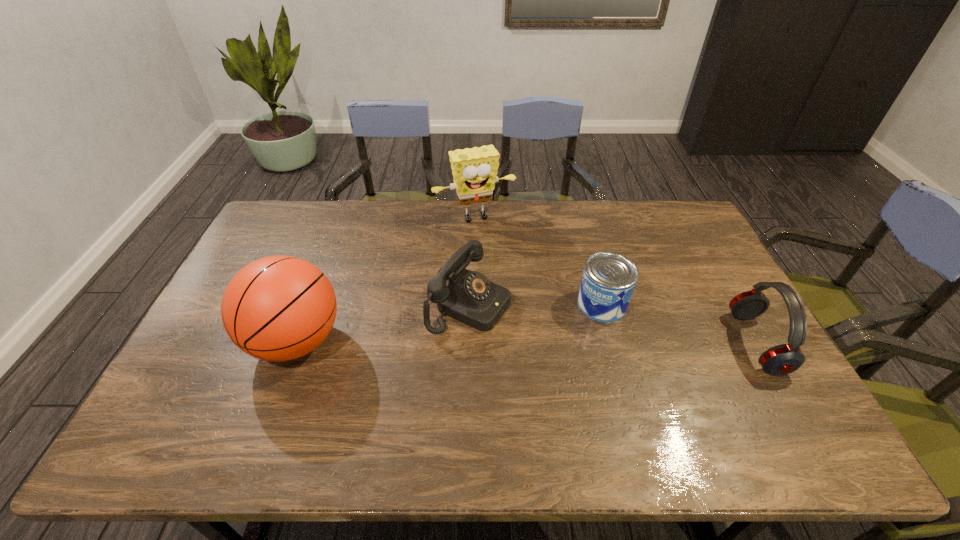
Locate an element on the screen. This screenshot has height=540, width=960. basketball is located at coordinates (278, 308).

At what (x,y) coordinates should I click in order to perform the action: click on earphone. Please return your answer as a coordinate pair (x, y). Looking at the image, I should click on (783, 359).

Find the location of `telephone`. telephone is located at coordinates (469, 297).

Identify the location of sponge. (474, 170).

Locate an element on the screen. can is located at coordinates (609, 279).

At what (x,y) coordinates should I click in order to perform the action: click on the fourth object from left to right. Please return your answer as a coordinate pair (x, y). The image size is (960, 540). Looking at the image, I should click on [x=609, y=279].

Identify the location of free space located on the back of the leftmost object. The height and width of the screenshot is (540, 960). (336, 235).

Locate an element on the screen. The height and width of the screenshot is (540, 960). vacant point located 0.270m on the ear cups of the earphone is located at coordinates (640, 343).

Identify the location of free space located on the ear cups of the earphone. (615, 343).

This screenshot has height=540, width=960. I want to click on free spot located 0.390m on the ear cups of the earphone, so click(597, 343).